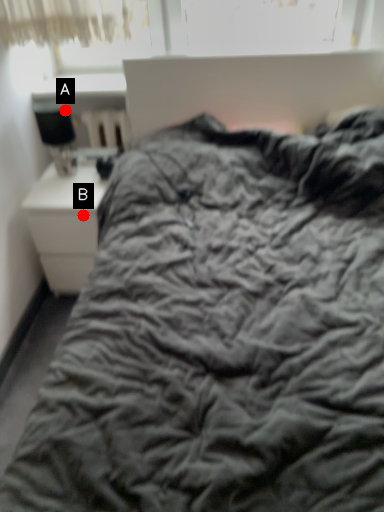
Question: Two points are circled on the image, labeled by A and B beside each circle. Which point is closer to the camera?

Choices:
 (A) A is closer
 (B) B is closer

Answer: (B)